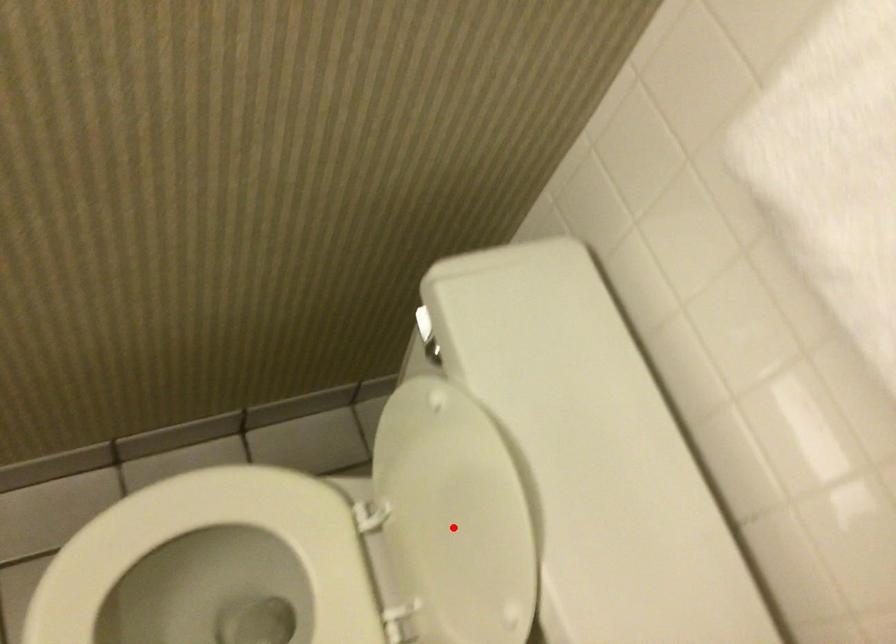
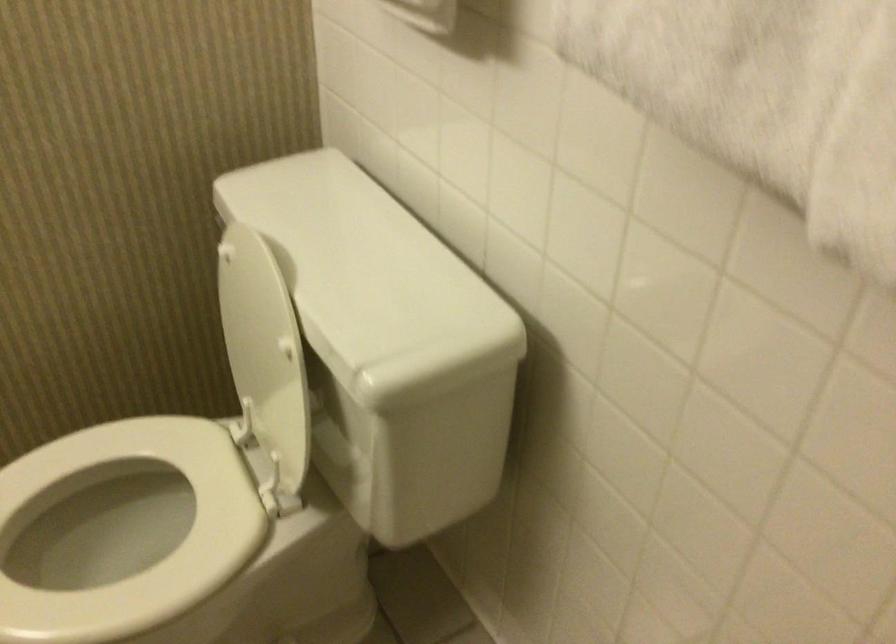
Locate, in the second image, the point that corresponds to the highlighted location in the first image.

(259, 343)